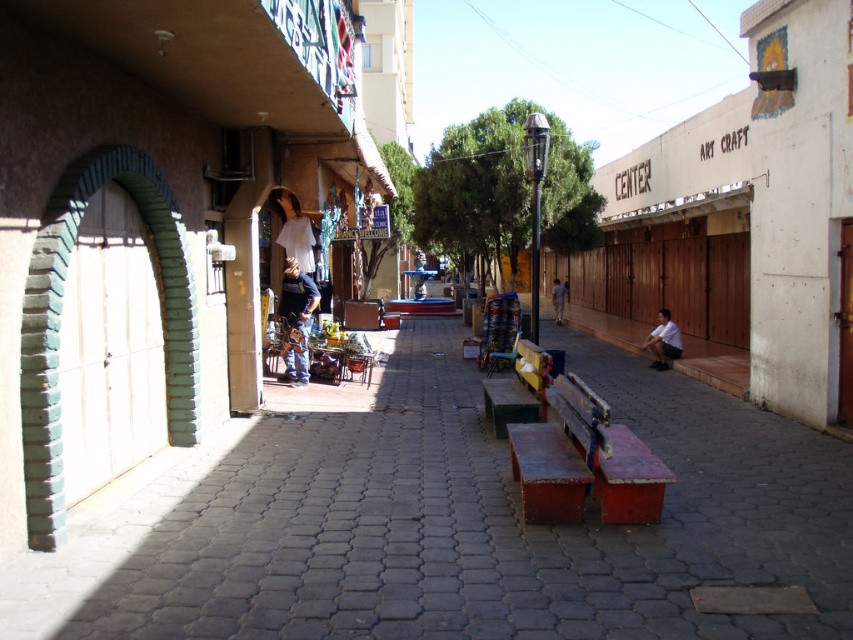
Can you confirm if rusty wood bench at center is wider than white matte shirt at center?

Yes, rusty wood bench at center is wider than white matte shirt at center.

Is point (639, 451) positioned behind point (665, 326)?

No.

Identify the location of rusty wood bench at center. This screenshot has height=640, width=853. (584, 461).

Does point (785, 570) come behind point (561, 289)?

That is False.

Where is `paved stone at center`? This screenshot has width=853, height=640. paved stone at center is located at coordinates (450, 520).

Does point (833, 524) lie behind point (561, 300)?

No, it is in front of (561, 300).

This screenshot has width=853, height=640. I want to click on paved stone at center, so click(x=450, y=520).

Which of these two, paved stone at center or wooden bench at center, stands taller?

With more height is wooden bench at center.

Is paved stone at center smaller than wooden bench at center?

No.

Is point (158, 518) closer to camera compared to point (535, 378)?

Yes, point (158, 518) is in front of point (535, 378).

You are a GUI agent. You are given a task and a screenshot of the screen. Output one action in this format:
    pyautogui.click(x=<x>, y=<y>)
    Task: Click on the paved stone at center
    This screenshot has width=853, height=640.
    Given the screenshot: What is the action you would take?
    pyautogui.click(x=450, y=520)